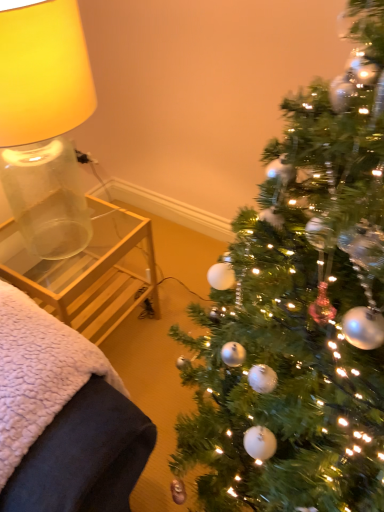
At what (x,y) coordinates should I click in order to perform the action: click on vacant point to the right of clear glass table at left. Please return your answer as a coordinate pair (x, y). Looking at the image, I should click on (168, 324).